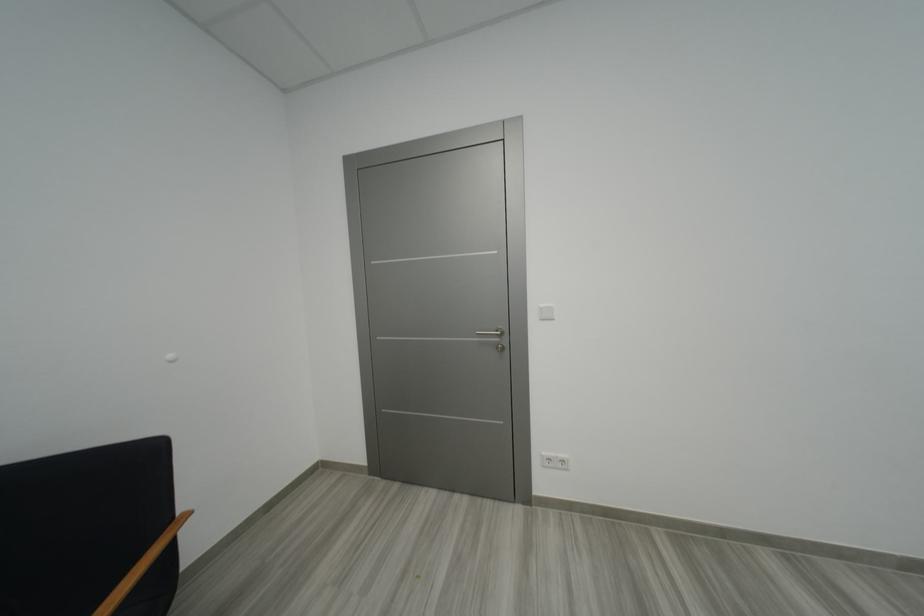
Where is `white light switch`? The height and width of the screenshot is (616, 924). white light switch is located at coordinates (545, 313).